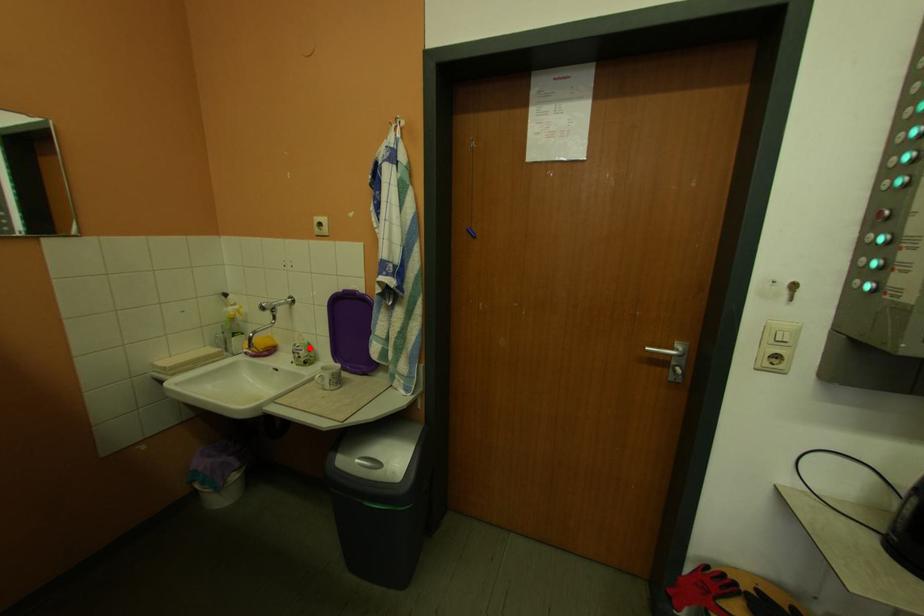
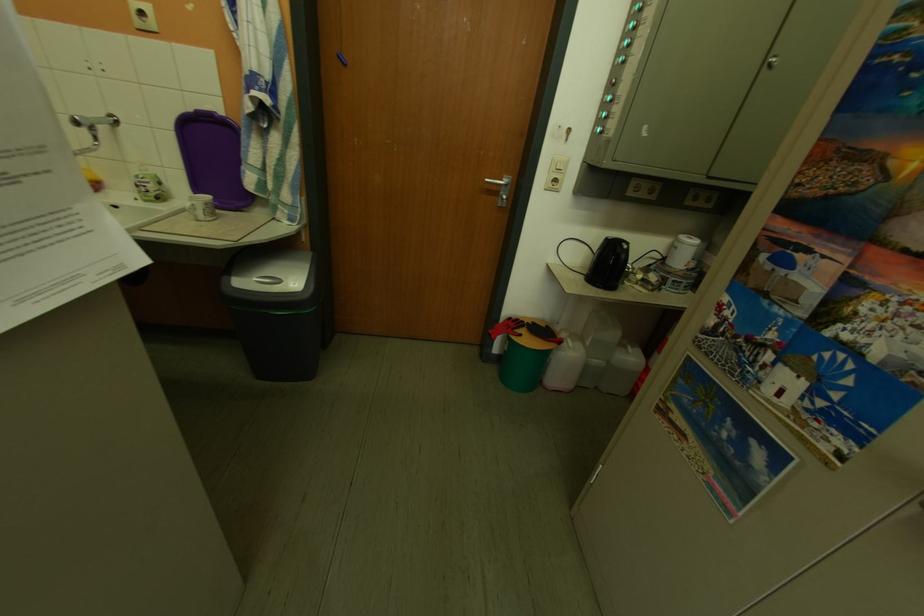
In the second image, find the point that corresponds to the highlighted location in the first image.

(154, 179)